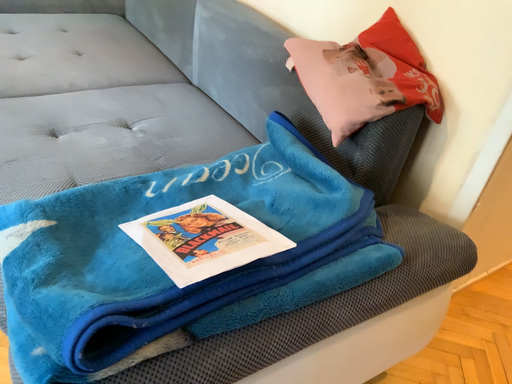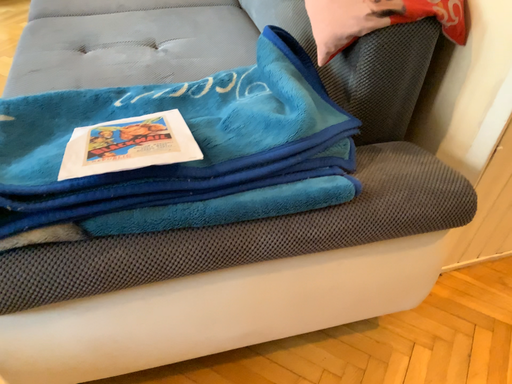
Question: How did the camera likely rotate when shooting the video?

Choices:
 (A) rotated upward
 (B) rotated downward

Answer: (B)